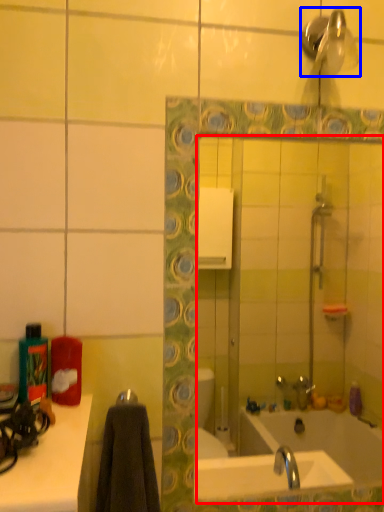
Question: Which of the following is the closest to the observer, mirror (highlighted by a red box) or shower (highlighted by a blue box)?

Choices:
 (A) mirror
 (B) shower

Answer: (B)